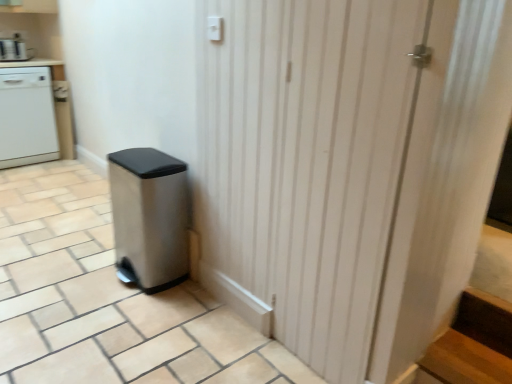
Question: Is white glossy dishwasher at left at the right side of stainless steel trash can at lower left?

Choices:
 (A) yes
 (B) no

Answer: (B)

Question: Can you confirm if white glossy dishwasher at left is taller than stainless steel trash can at lower left?

Choices:
 (A) no
 (B) yes

Answer: (B)

Question: Is white glossy dishwasher at left facing towards stainless steel trash can at lower left?

Choices:
 (A) no
 (B) yes

Answer: (B)

Question: From the image's perspective, would you say white glossy dishwasher at left is shown under stainless steel trash can at lower left?

Choices:
 (A) yes
 (B) no

Answer: (B)

Question: Is white glossy dishwasher at left oriented away from stainless steel trash can at lower left?

Choices:
 (A) no
 (B) yes

Answer: (A)

Question: Is white glossy dishwasher at left to the left of stainless steel trash can at lower left from the viewer's perspective?

Choices:
 (A) no
 (B) yes

Answer: (B)

Question: Considering the relative sizes of stainless steel trash can at lower left and white glossy dishwasher at left in the image provided, is stainless steel trash can at lower left bigger than white glossy dishwasher at left?

Choices:
 (A) no
 (B) yes

Answer: (A)

Question: Is stainless steel trash can at lower left positioned with its back to white glossy dishwasher at left?

Choices:
 (A) no
 (B) yes

Answer: (A)

Question: Considering the relative positions of stainless steel trash can at lower left and white glossy dishwasher at left in the image provided, is stainless steel trash can at lower left behind white glossy dishwasher at left?

Choices:
 (A) yes
 (B) no

Answer: (B)

Question: Considering the relative sizes of stainless steel trash can at lower left and white glossy dishwasher at left in the image provided, is stainless steel trash can at lower left smaller than white glossy dishwasher at left?

Choices:
 (A) no
 (B) yes

Answer: (B)

Question: From the image's perspective, would you say stainless steel trash can at lower left is shown under white glossy dishwasher at left?

Choices:
 (A) no
 (B) yes

Answer: (B)

Question: Is stainless steel trash can at lower left not inside white glossy dishwasher at left?

Choices:
 (A) no
 (B) yes

Answer: (B)

Question: From the image's perspective, would you say stainless steel trash can at lower left is shown under brushed metal coffee maker at upper left?

Choices:
 (A) no
 (B) yes

Answer: (B)